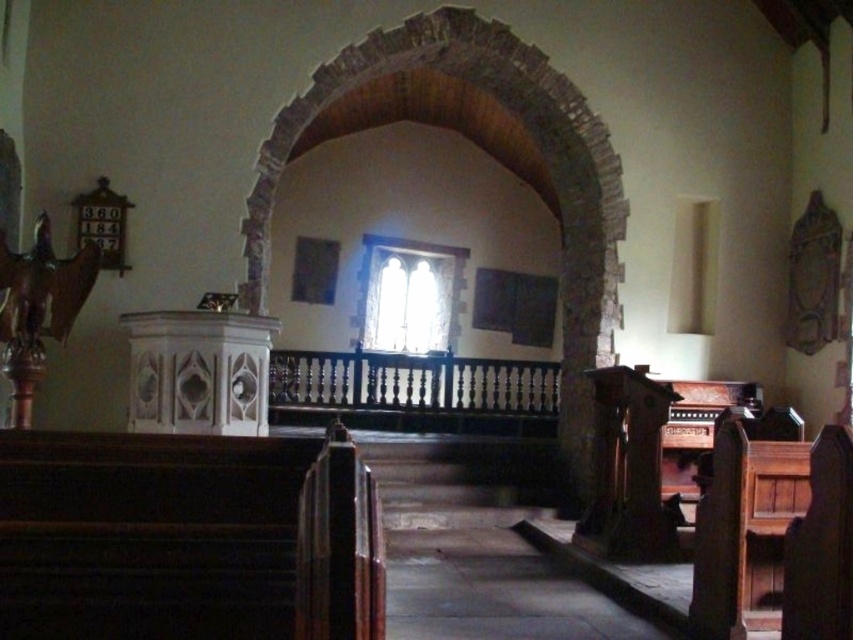
Can you confirm if brick textured archway at center is smaller than dark brown polished wood church bench at lower right?

Yes.

Is point (596, 236) more distant than point (779, 483)?

Yes, point (596, 236) is farther from viewer.

Which is behind, point (541, 124) or point (709, 614)?

Positioned behind is point (541, 124).

Identify the location of brick textured archway at center. The image size is (853, 640). (498, 161).